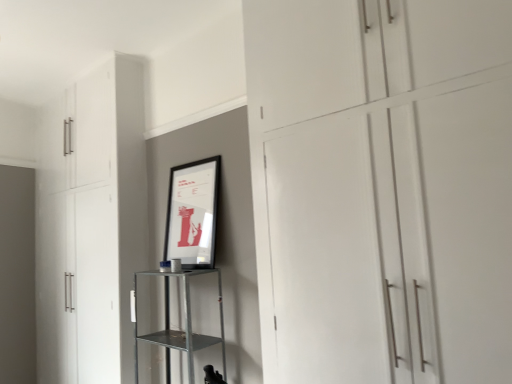
Question: Can you confirm if white matte cabinet at left, placed as the first cupboard when sorted from left to right, is wider than metallic silver shelf at center?

Choices:
 (A) yes
 (B) no

Answer: (B)

Question: From a real-world perspective, does white matte cabinet at left, marked as the second cupboard in a front-to-back arrangement, stand above metallic silver shelf at center?

Choices:
 (A) yes
 (B) no

Answer: (A)

Question: From the image's perspective, does white matte cabinet at left, marked as the second cupboard in a front-to-back arrangement, appear lower than metallic silver shelf at center?

Choices:
 (A) no
 (B) yes

Answer: (A)

Question: Is white matte cabinet at left, the first cupboard when ordered from back to front, smaller than metallic silver shelf at center?

Choices:
 (A) no
 (B) yes

Answer: (A)

Question: Can you confirm if white matte cabinet at left, marked as the second cupboard in a front-to-back arrangement, is shorter than metallic silver shelf at center?

Choices:
 (A) no
 (B) yes

Answer: (A)

Question: Considering the positions of white matte cupboard at center, which is the 2th cupboard from left to right, and metallic silver shelf at center in the image, is white matte cupboard at center, which is the 2th cupboard from left to right, bigger or smaller than metallic silver shelf at center?

Choices:
 (A) small
 (B) big

Answer: (B)

Question: Considering the positions of white matte cupboard at center, which is the 2th cupboard from left to right, and metallic silver shelf at center in the image, is white matte cupboard at center, which is the 2th cupboard from left to right, taller or shorter than metallic silver shelf at center?

Choices:
 (A) tall
 (B) short

Answer: (A)

Question: From the image's perspective, is white matte cupboard at center, which ranks as the 1th cupboard in right-to-left order, above or below metallic silver shelf at center?

Choices:
 (A) below
 (B) above

Answer: (B)

Question: Considering the positions of point (323, 213) and point (168, 331), is point (323, 213) closer or farther from the camera than point (168, 331)?

Choices:
 (A) closer
 (B) farther

Answer: (A)

Question: Looking at their shapes, would you say matte black picture frame at center is wider or thinner than white matte cupboard at center, the first cupboard when ordered from front to back?

Choices:
 (A) wide
 (B) thin

Answer: (B)

Question: Considering the positions of point (214, 208) and point (290, 332), is point (214, 208) closer or farther from the camera than point (290, 332)?

Choices:
 (A) farther
 (B) closer

Answer: (A)

Question: Visually, is matte black picture frame at center positioned to the left or to the right of white matte cupboard at center, which is the 2th cupboard from left to right?

Choices:
 (A) right
 (B) left

Answer: (B)

Question: Relative to white matte cupboard at center, the first cupboard when ordered from front to back, is matte black picture frame at center in front or behind?

Choices:
 (A) front
 (B) behind

Answer: (B)

Question: Choose the correct answer: Is white matte cupboard at center, which appears as the 2th cupboard when viewed from the back, inside matte black picture frame at center or outside it?

Choices:
 (A) inside
 (B) outside

Answer: (B)

Question: From the image's perspective, is white matte cupboard at center, which is the 2th cupboard from left to right, above or below matte black picture frame at center?

Choices:
 (A) below
 (B) above

Answer: (B)